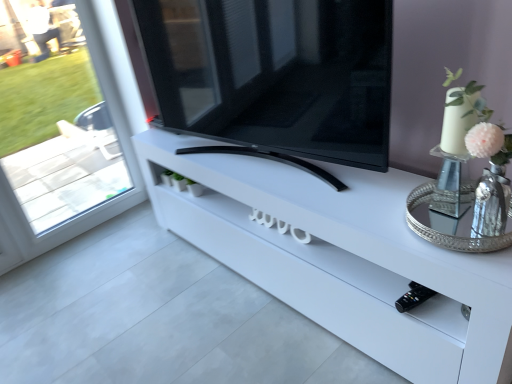
Identify the location of free spot below black glossy tv at center (from a real-world perspective). The height and width of the screenshot is (384, 512). (264, 156).